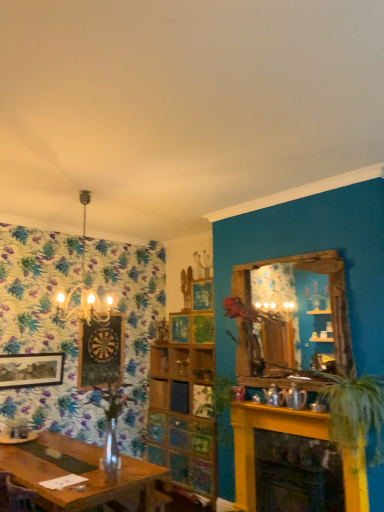
Where is `empty space that is ontop of gold metallic chandelier at upper left (from a real-world perspective)`? This screenshot has width=384, height=512. empty space that is ontop of gold metallic chandelier at upper left (from a real-world perspective) is located at coordinates (75, 193).